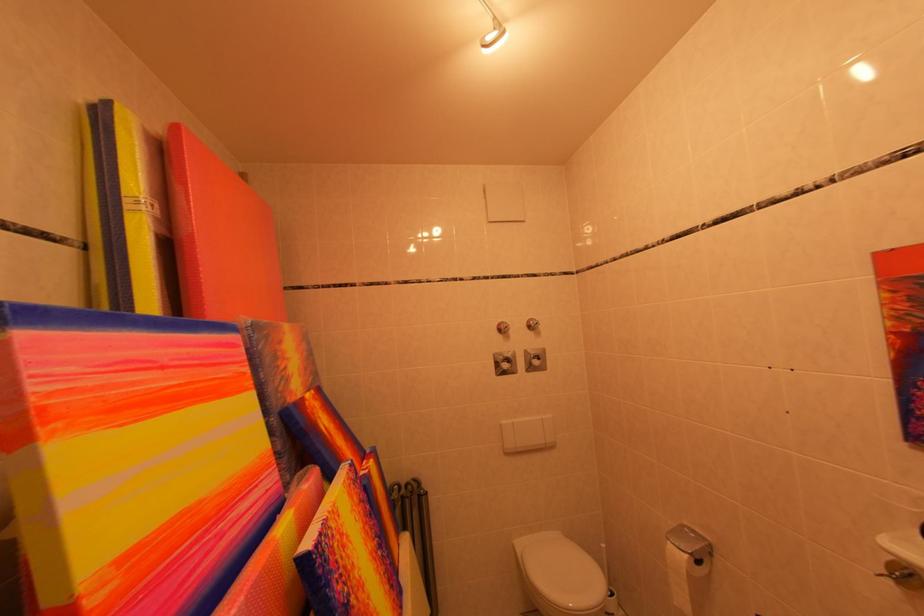
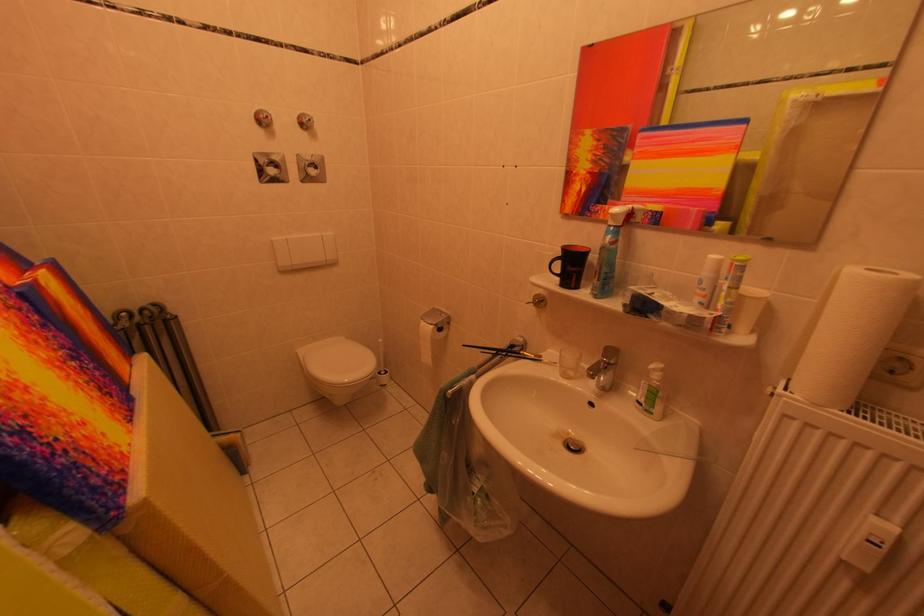
Where in the second image is the point corresponding to (x=515, y=369) from the first image?

(282, 175)